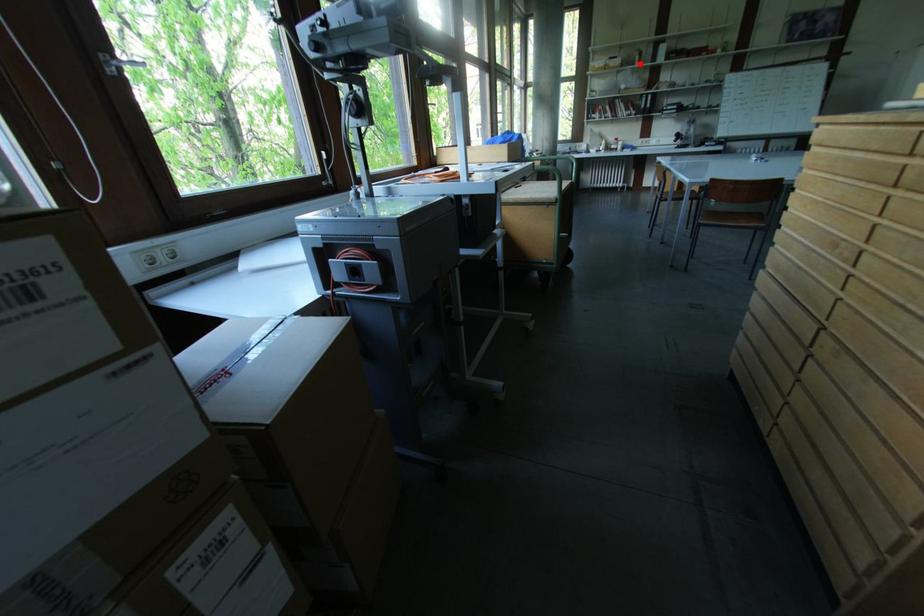
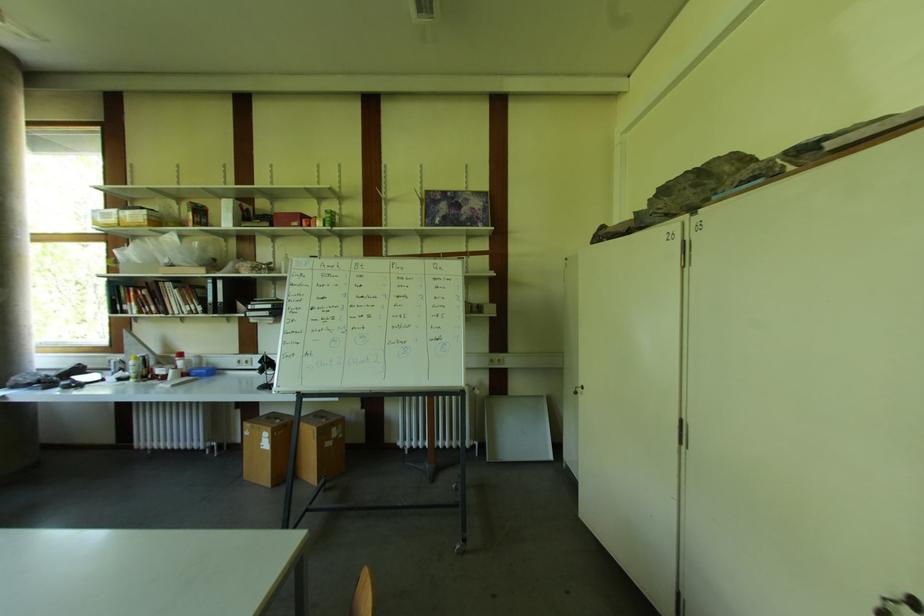
The point at the highlighted location is marked in the first image. Where is the corresponding point in the second image?

(193, 225)